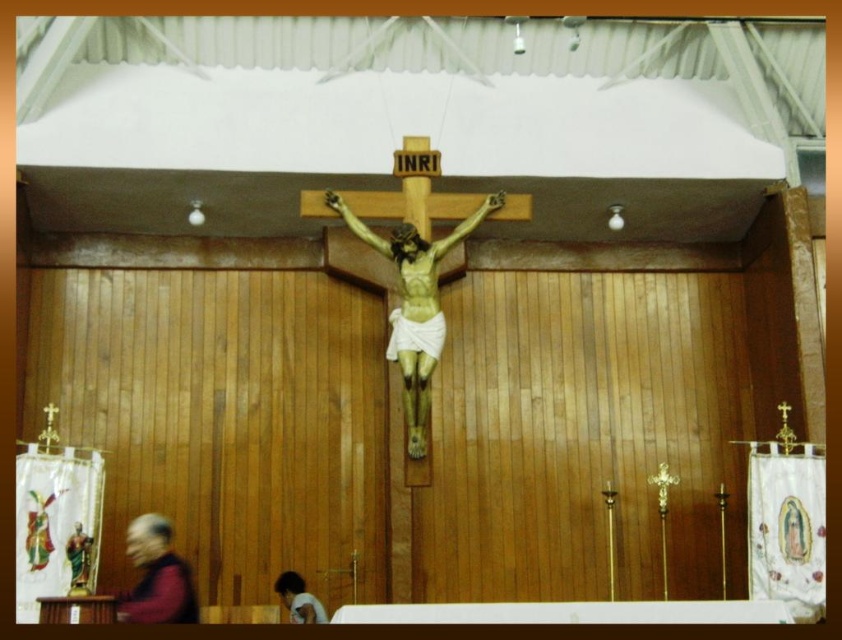
You are an interior designer planning to install a new light fixture in the church. The light will be placed at coordinates between 0.8 and 0.9 on the x and y axes. Will the light interfere with the smooth gray hair at lower left?

The smooth gray hair at lower left is located at point (x=156, y=577), which falls within the x and y range of 0.8 to 0.9. Therefore, the light fixture will interfere with the smooth gray hair at lower left.

You are an art student analyzing the composition of the church interior. You observe the wooden crucifix at center and the light brown skin at lower center. Which object occupies a more prominent vertical space in the scene?

The wooden crucifix at center has a greater height compared to the light brown skin at lower center, so it occupies more prominent vertical space.

You are standing in the church and want to take a closer look at the crucifix. If you walk straight towards the point at coordinates point (155, 577), which is 38.51 meters away from you, will you reach the crucifix before reaching the point?

The point at coordinates point (155, 577) is 38.51 meters away from you. Since the crucifix is located at the center of the composition, you would reach the crucifix before reaching the point.